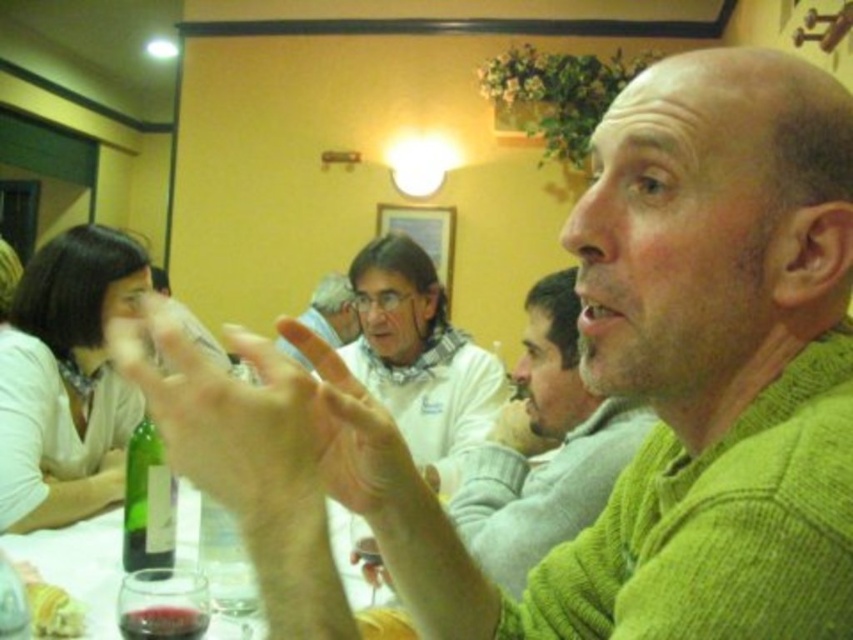
You are a photographer standing at the camera position in the image. You want to take a closeup shot of the green glass bottle at lower left. Can you reach it without moving your feet?

The green glass bottle at lower left is 1.20 meters away from camera, so yes, you can reach it without moving your feet as it is within a comfortable distance.

You are at a restaurant and want to grab the green glass bottle at lower left. The coordinates given are point A at (148,500). Is point A on the green glass bottle at lower left?

Yes, the point A at (148,500) is on the green glass bottle at lower left according to the description.